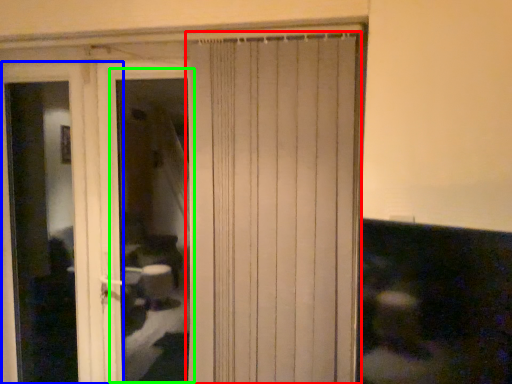
Question: Considering the real-world distances, which object is farthest from curtain (highlighted by a red box)? screen door (highlighted by a blue box) or window (highlighted by a green box)?

Choices:
 (A) screen door
 (B) window

Answer: (B)